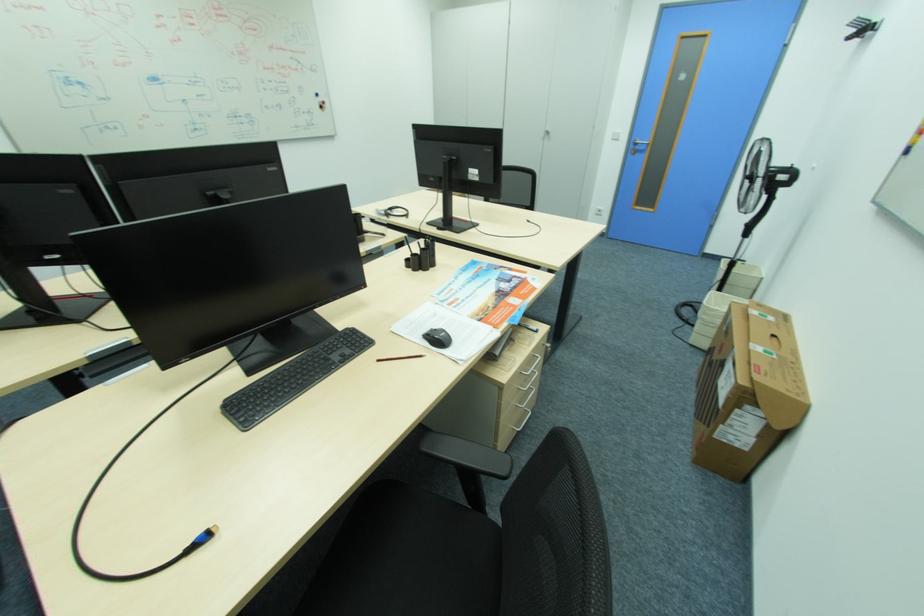
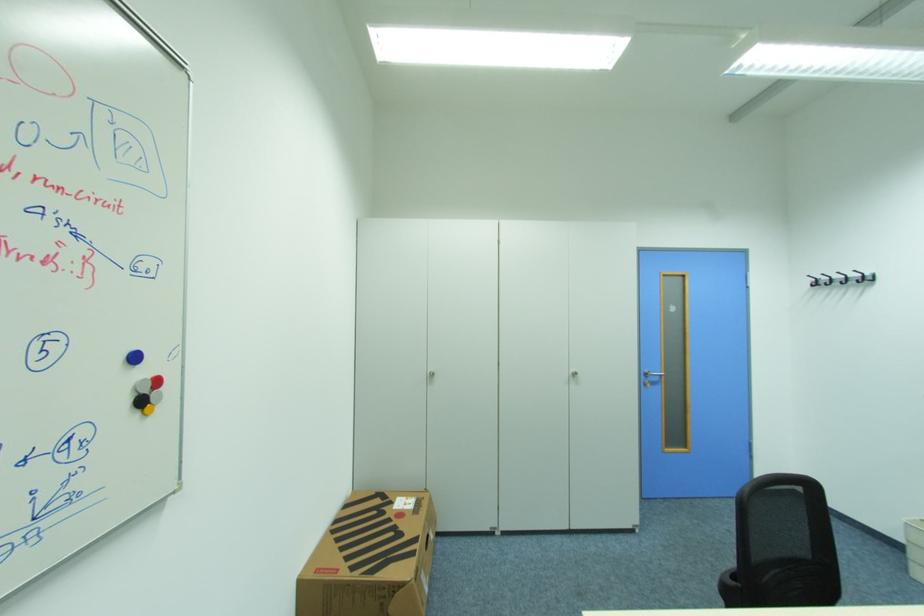
Where in the second image is the point corresponding to point 331,103 from the first image?

(162, 382)